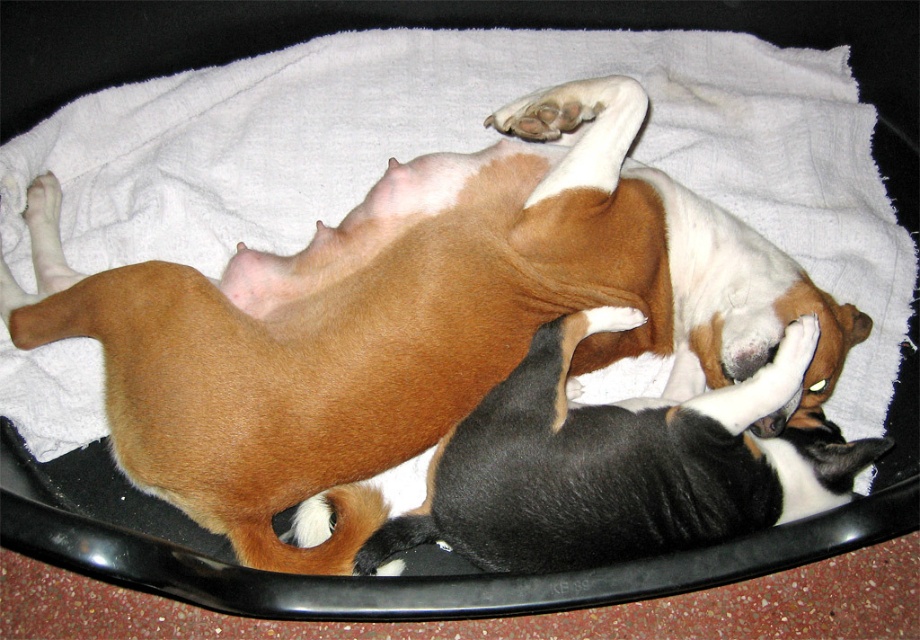
Question: Can you confirm if brown smooth dog at upper center is smaller than black and white fur at center?

Choices:
 (A) no
 (B) yes

Answer: (A)

Question: Which object appears closest to the camera in this image?

Choices:
 (A) brown smooth dog at upper center
 (B) black and white fur at center

Answer: (B)

Question: Does brown smooth dog at upper center have a greater width compared to black and white fur at center?

Choices:
 (A) no
 (B) yes

Answer: (B)

Question: Does brown smooth dog at upper center lie in front of black and white fur at center?

Choices:
 (A) no
 (B) yes

Answer: (A)

Question: Which object is farther from the camera taking this photo?

Choices:
 (A) black and white fur at center
 (B) brown smooth dog at upper center

Answer: (B)